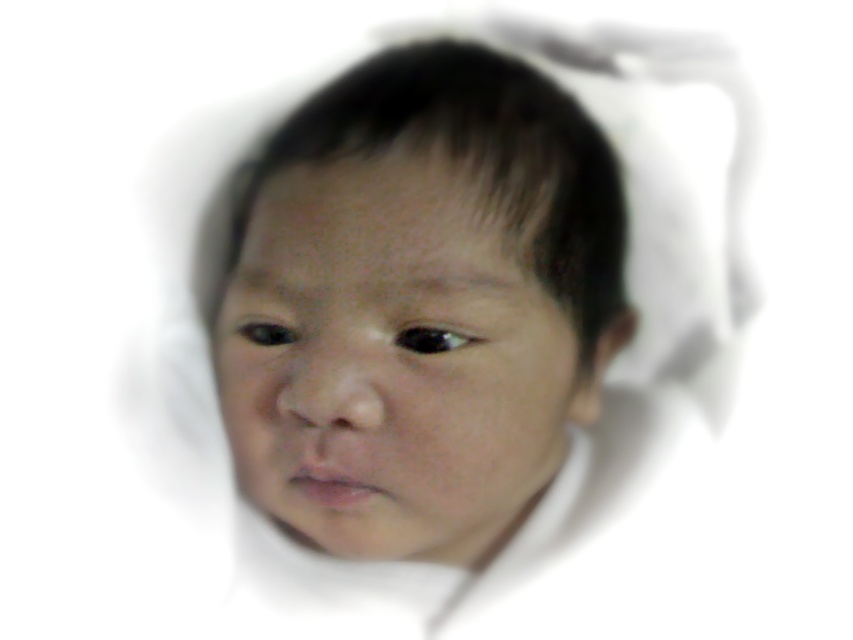
Can you confirm if black glossy eye at center is positioned above black eye at center?

Incorrect, black glossy eye at center is not positioned above black eye at center.

Which is behind, point (422, 353) or point (245, 337)?

Positioned behind is point (245, 337).

Find the location of a particular element. The image size is (853, 640). black glossy eye at center is located at coordinates (432, 339).

Between smooth skin face at center and black glossy eye at center, which one appears on the right side from the viewer's perspective?

From the viewer's perspective, black glossy eye at center appears more on the right side.

Is smooth skin face at center thinner than black glossy eye at center?

Incorrect, smooth skin face at center's width is not less than black glossy eye at center's.

Find the location of `smooth skin face at center`. smooth skin face at center is located at coordinates (392, 364).

Who is positioned more to the left, smooth skin face at center or black eye at center?

From the viewer's perspective, black eye at center appears more on the left side.

Describe the element at coordinates (392, 364) in the screenshot. The width and height of the screenshot is (853, 640). I see `smooth skin face at center` at that location.

Where is `smooth skin face at center`? The image size is (853, 640). smooth skin face at center is located at coordinates (392, 364).